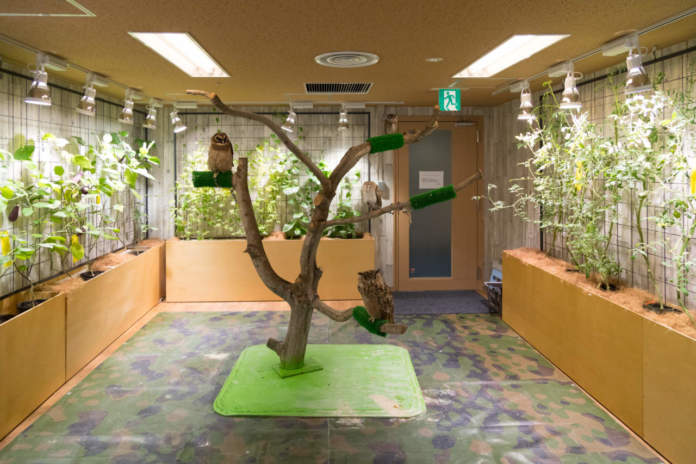
I want to click on exit sign, so click(x=443, y=94).